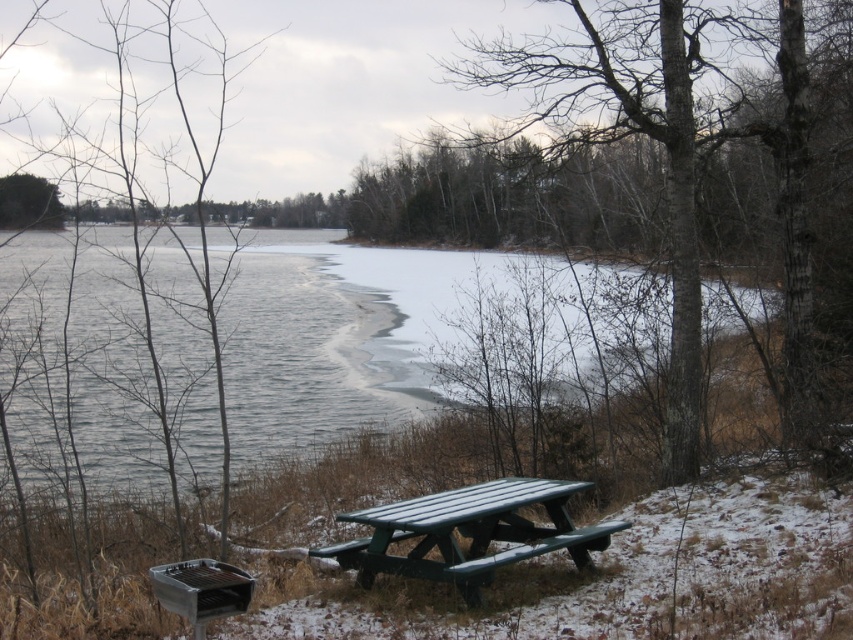
Is smooth metal grill at lower left shorter than green leafy tree at upper left?

In fact, smooth metal grill at lower left may be taller than green leafy tree at upper left.

Is point (212, 307) in front of point (62, 212)?

Yes, point (212, 307) is closer to viewer.

The width and height of the screenshot is (853, 640). What do you see at coordinates (96, 147) in the screenshot?
I see `smooth metal grill at lower left` at bounding box center [96, 147].

The height and width of the screenshot is (640, 853). In order to click on smooth metal grill at lower left in this screenshot , I will do `click(96, 147)`.

Between green plastic picnic table at center and green leafy tree at upper left, which one is positioned higher?

green leafy tree at upper left is higher up.

Which is in front, point (456, 580) or point (15, 177)?

Positioned in front is point (456, 580).

Between point (416, 545) and point (16, 182), which one is positioned in front?

Point (416, 545) is more forward.

Image resolution: width=853 pixels, height=640 pixels. Find the location of `green plastic picnic table at center`. green plastic picnic table at center is located at coordinates (468, 532).

Does smooth bark tree at center appear under smooth metal grill at lower left?

No, smooth bark tree at center is not below smooth metal grill at lower left.

This screenshot has width=853, height=640. I want to click on smooth bark tree at center, so click(630, 134).

Locate an element on the screen. The image size is (853, 640). smooth bark tree at center is located at coordinates (630, 134).